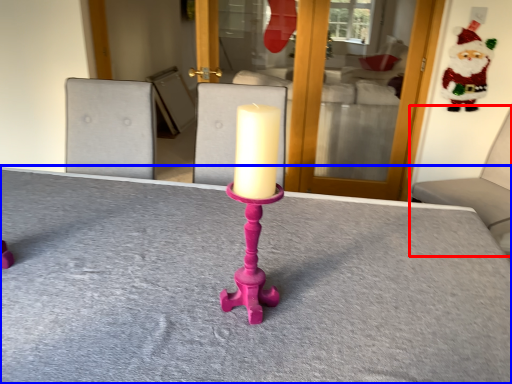
Question: Which object is closer to the camera taking this photo, furniture (highlighted by a red box) or table (highlighted by a blue box)?

Choices:
 (A) furniture
 (B) table

Answer: (B)